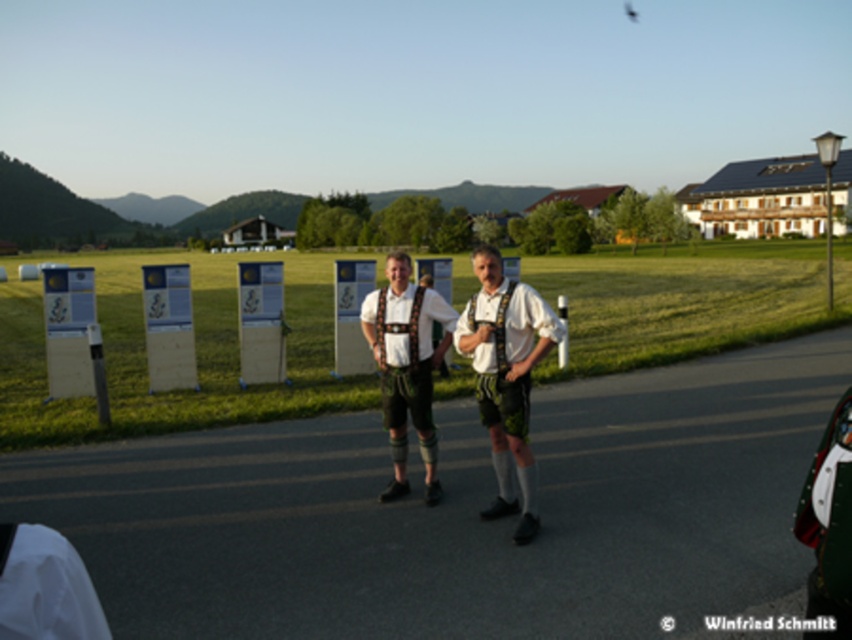
From the picture: You are a photographer trying to capture the two points in the image. Which point, point (522,410) or point (108,637), is closer to the camera?

Point (522,410) is closer to the camera than point (108,637) because it is further to the viewer.

You are standing at the point with coordinates point (373,301) and want to walk towards the point with coordinates point (507,387). Which direction should you face to move towards it?

You should face forward because point (507,387) is in front of point (373,301).